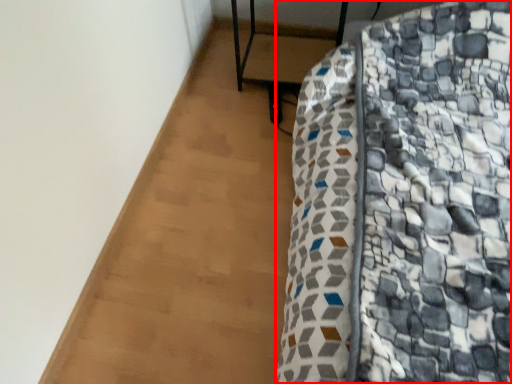
Question: From the image's perspective, where is furniture (annotated by the red box) located relative to furniture?

Choices:
 (A) above
 (B) below

Answer: (B)